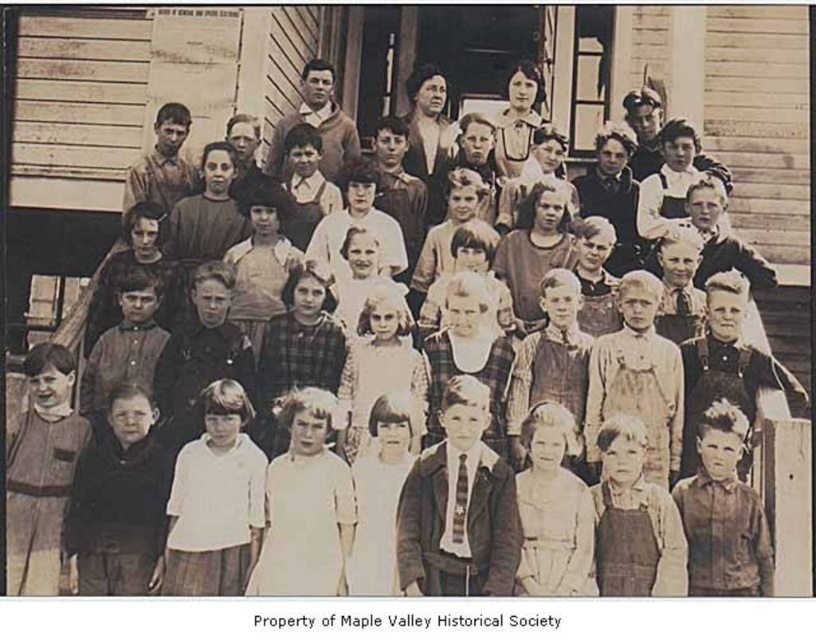
You are a photographer analyzing this vintage school photo. You notice a point at coordinates (429, 136). What object is located at this point?

The object located at point (429, 136) is the matte brown dress at center.

You are a photographer analyzing this vintage school photo. You notice two central figures wearing a matte brown dress at center and a matte white blouse at center. Which of these two garments is worn by someone who is standing in a row closer to the front of the group?

The matte brown dress at center is taller than the matte white blouse at center, indicating the person wearing the matte brown dress at center is standing in a row closer to the front, as they appear taller in the photo.

You are a photographer trying to capture a detailed closeup of the matte brown dress at center. Based on the scene, can you determine if the dress is within a 100 meter range for your camera to focus properly?

The matte brown dress at center is 64.85 meters from the camera, which is within the 100 meter range, so the camera can focus properly on it.